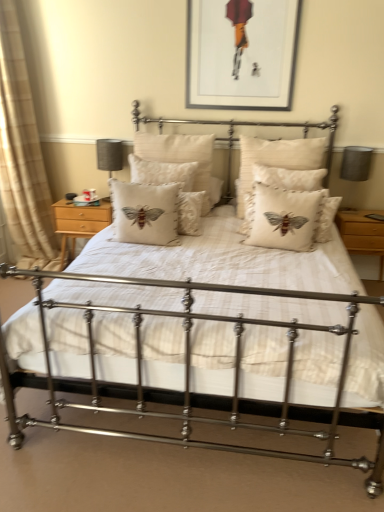
Question: Is point (144, 226) positioned closer to the camera than point (251, 157)?

Choices:
 (A) closer
 (B) farther

Answer: (A)

Question: From the image's perspective, is beige cotton cushion with embroidered bee at center, which is the fourth pillow in right-to-left order, positioned above or below creamy linen cushion with embroidered bee at center, the fourth pillow viewed from the left?

Choices:
 (A) above
 (B) below

Answer: (B)

Question: Considering the real-world distances, which object is closest to the matte gray lampshade at left, positioned as the first table lamp in left-to-right order?

Choices:
 (A) beige linen cushion with embroidered moth at center, the second pillow from the left
 (B) matte black picture frame at upper center
 (C) creamy linen cushion with embroidered bee at center, marked as the first pillow in a right-to-left arrangement
 (D) wooden nightstand at right, the second nightstand in the left-to-right sequence
 (E) matte gray lampshade at right, the second table lamp positioned from the left

Answer: (A)

Question: Estimate the real-world distances between objects in this image. Which object is farther from the beige linen cushion with embroidered moth at center, the third pillow in the right-to-left sequence?

Choices:
 (A) beige cotton cushion with embroidered bee at center, which is the fourth pillow in right-to-left order
 (B) wooden nightstand at right, the second nightstand in the left-to-right sequence
 (C) matte gray lampshade at right, the second table lamp positioned from the left
 (D) creamy linen cushion with embroidered bee at center, marked as the first pillow in a right-to-left arrangement
 (E) light wood/finely crafted nightstand at left, arranged as the first nightstand when viewed from the left

Answer: (B)